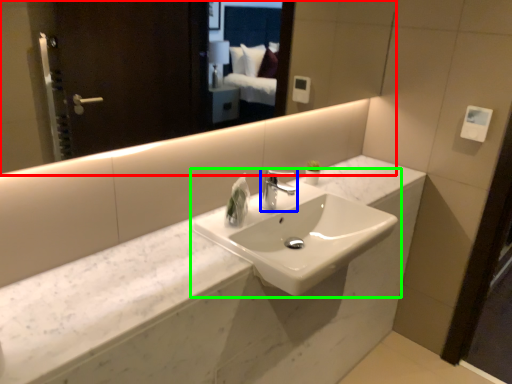
Question: Which object is positioned farthest from mirror (highlighted by a red box)? Select from tap (highlighted by a blue box) and sink (highlighted by a green box).

Choices:
 (A) tap
 (B) sink

Answer: (B)